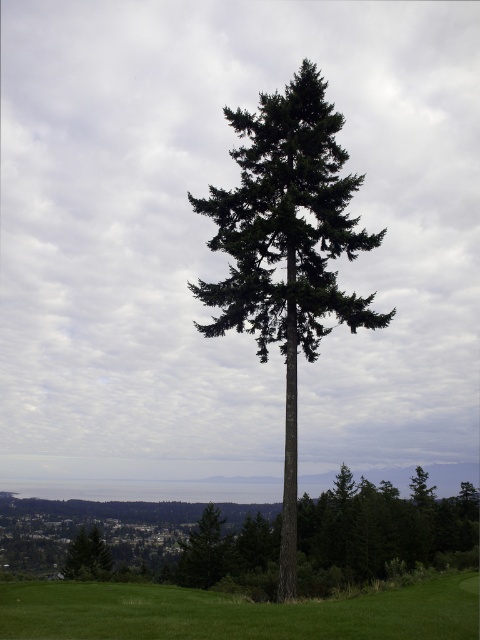
You are planning to plant a new garden and want to know which area is larger between the green matte tree at center and the green grassy field at center. Which one takes up more space?

The green grassy field at center takes up more space than the green matte tree at center because the green matte tree at center occupies less space than green grassy field at center.

You are a gardener planning to plant a new flower bed. You have two options for locations in the image. One is near the green grassy field at center and the other is near the green matte tree at lower left. Which location has more space available for planting?

The green matte tree at lower left has more space available for planting because the green grassy field at center is smaller than it.